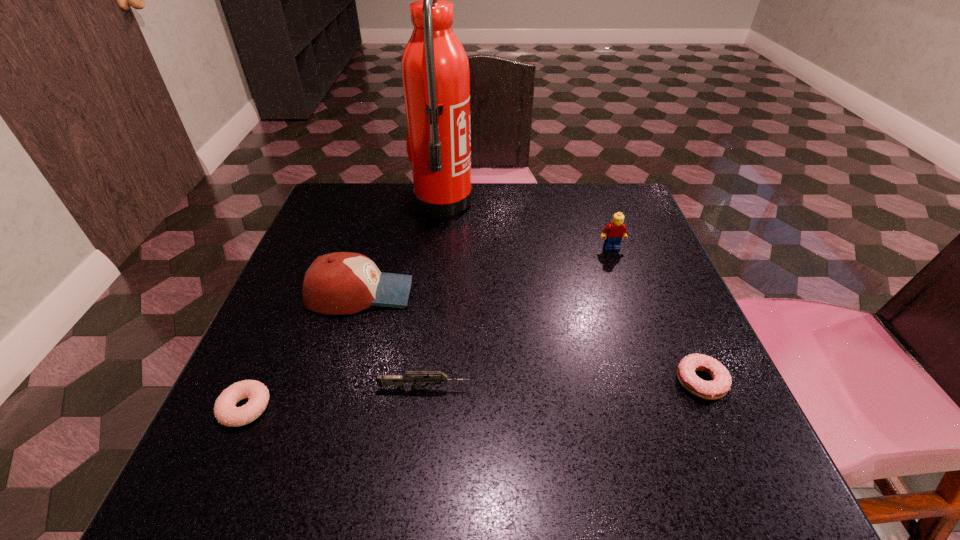
This screenshot has width=960, height=540. What are the coordinates of `vacant space situated 0.060m aimed along the barrel of the fourth tallest object` in the screenshot? It's located at (506, 389).

Locate an element on the screen. This screenshot has width=960, height=540. free point located 0.270m on the left of the right doughnut is located at coordinates (516, 382).

This screenshot has height=540, width=960. I want to click on vacant space located on the back of the left doughnut, so click(x=316, y=248).

Locate an element on the screen. This screenshot has width=960, height=540. object at the far edge is located at coordinates (435, 70).

Identify the location of baseball cap positioned at the left edge. This screenshot has width=960, height=540. click(338, 283).

Identify the location of doughnut that is at the left edge. (225, 411).

Find the location of a particular element. The height and width of the screenshot is (540, 960). Lego situated at the right edge is located at coordinates (613, 233).

Identify the location of doughnut that is positioned at the right edge. Image resolution: width=960 pixels, height=540 pixels. (721, 382).

The image size is (960, 540). In the image, there is a desktop. Find the location of `vacant space at the far edge`. vacant space at the far edge is located at coordinates (384, 226).

You are a GUI agent. You are given a task and a screenshot of the screen. Output one action in this format:
    pyautogui.click(x=<x>, y=<y>)
    Task: Click on the vacant region at the left edge
    
    Given the screenshot: What is the action you would take?
    pyautogui.click(x=302, y=302)